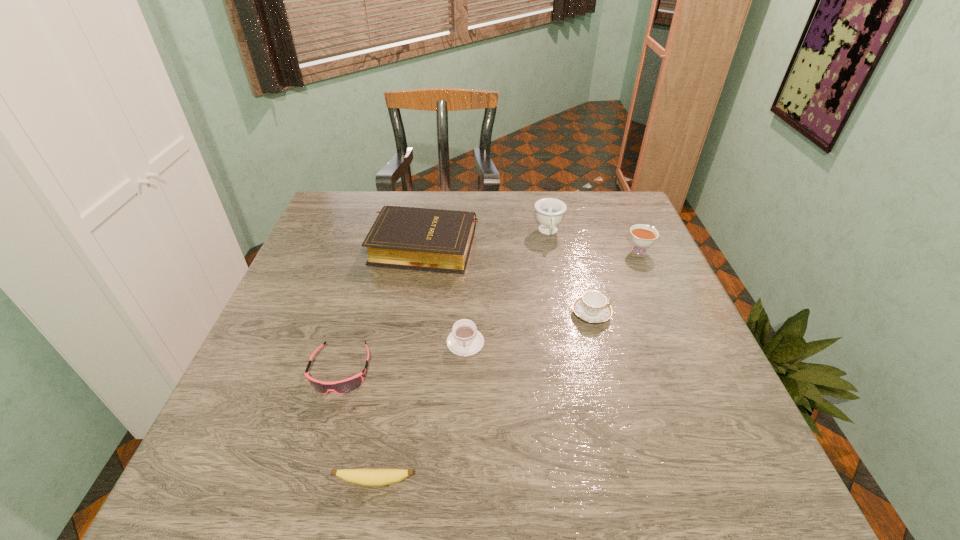
In order to click on the tallest teacup in this screenshot , I will do `click(550, 211)`.

This screenshot has height=540, width=960. I want to click on Bible, so click(438, 240).

Identify the location of the rightmost teacup. (x=642, y=236).

Locate an element on the screen. The image size is (960, 540). the rightmost object is located at coordinates (642, 236).

Locate an element on the screen. the fourth nearest object is located at coordinates [x=592, y=307].

At what (x,y) coordinates should I click in order to perform the action: click on goggles. Please return your answer as a coordinate pair (x, y). Looking at the image, I should click on (347, 385).

This screenshot has width=960, height=540. I want to click on the nearest teacup, so click(465, 340).

This screenshot has width=960, height=540. I want to click on the nearest object, so click(x=365, y=477).

You are a GUI agent. You are given a task and a screenshot of the screen. Output one action in this format:
    pyautogui.click(x=<x>, y=<y>)
    Task: Click on the vacant area situated on the side of the tallest teacup with the handle
    Image resolution: width=960 pixels, height=540 pixels.
    Given the screenshot: What is the action you would take?
    pyautogui.click(x=557, y=275)

Image resolution: width=960 pixels, height=540 pixels. Identify the location of free region located 0.210m on the right of the Bible. (554, 246).